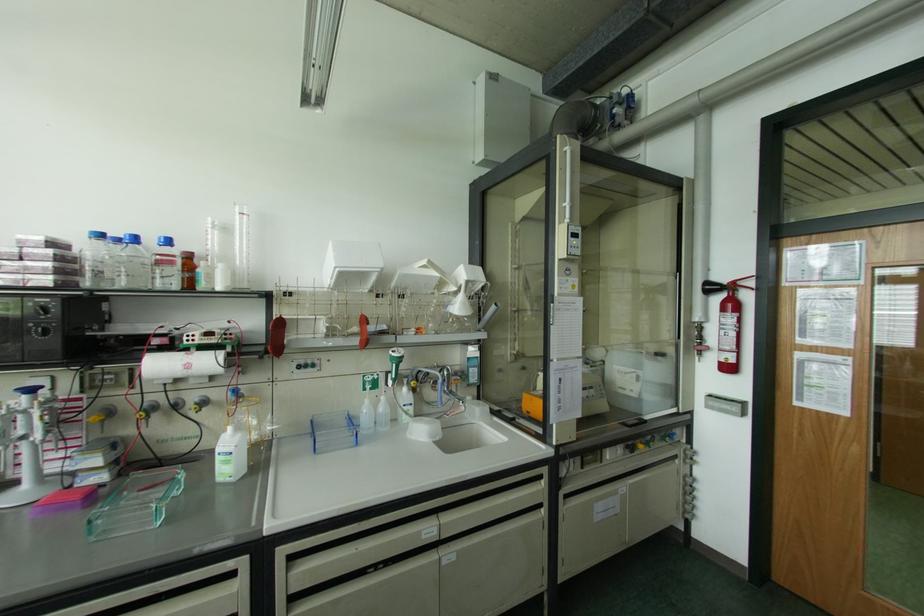
Where would you turn the blue control knob? Please return your answer as a coordinate pair (x, y).

(200, 403)